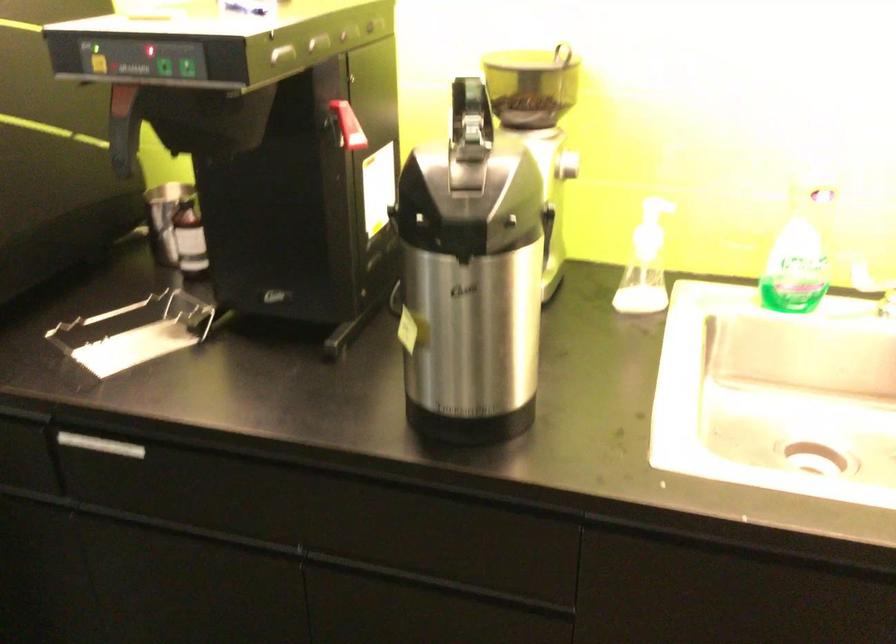
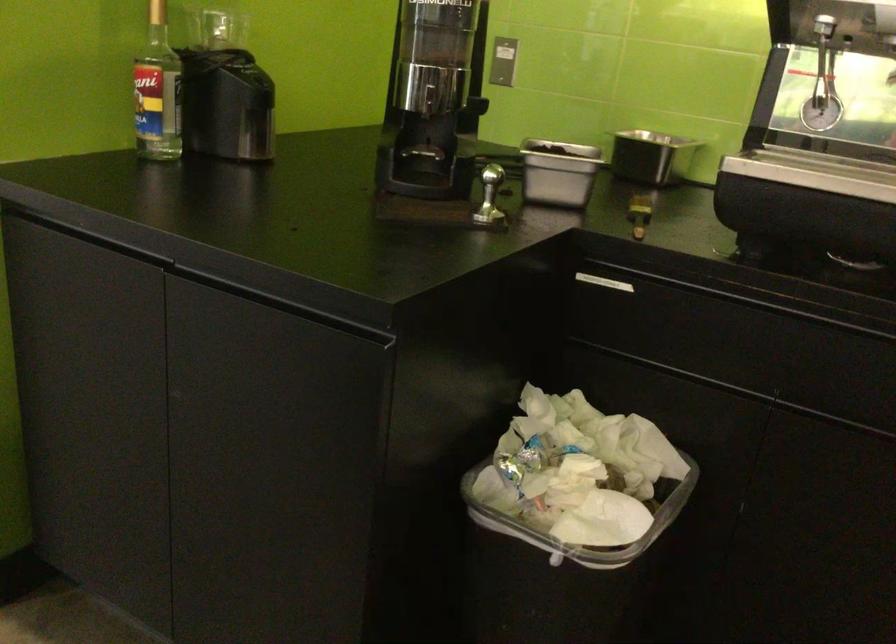
Question: The images are taken continuously from a first-person perspective. In which direction are you moving?

Choices:
 (A) Left
 (B) Right
 (C) Forward
 (D) Backward

Answer: (A)